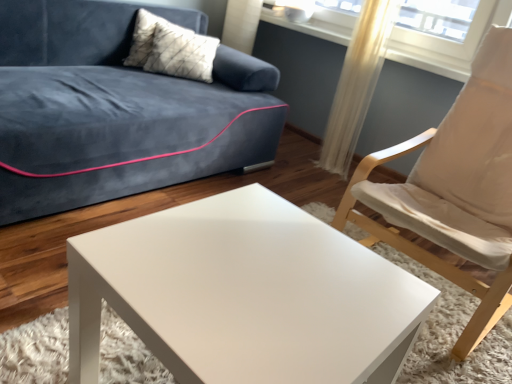
Question: Is white textured pillow at upper left behind translucent fabric curtain at upper right?

Choices:
 (A) yes
 (B) no

Answer: (A)

Question: From a real-world perspective, is white textured pillow at upper left physically above translucent fabric curtain at upper right?

Choices:
 (A) no
 (B) yes

Answer: (B)

Question: Does white textured pillow at upper left have a smaller size compared to translucent fabric curtain at upper right?

Choices:
 (A) yes
 (B) no

Answer: (B)

Question: Is translucent fabric curtain at upper right completely or partially inside white textured pillow at upper left?

Choices:
 (A) yes
 (B) no

Answer: (B)

Question: Is white textured pillow at upper left completely or partially outside of translucent fabric curtain at upper right?

Choices:
 (A) yes
 (B) no

Answer: (A)

Question: Is white textured pillow at upper left at the right side of translucent fabric curtain at upper right?

Choices:
 (A) no
 (B) yes

Answer: (A)

Question: Is white glossy coffee table at center in front of white fabric chair at right?

Choices:
 (A) no
 (B) yes

Answer: (B)

Question: From a real-world perspective, is white glossy coffee table at center positioned over white fabric chair at right based on gravity?

Choices:
 (A) yes
 (B) no

Answer: (B)

Question: Does white glossy coffee table at center turn towards white fabric chair at right?

Choices:
 (A) yes
 (B) no

Answer: (B)

Question: Can white fabric chair at right be found inside white glossy coffee table at center?

Choices:
 (A) yes
 (B) no

Answer: (B)

Question: Is white glossy coffee table at center at the right side of white fabric chair at right?

Choices:
 (A) no
 (B) yes

Answer: (A)

Question: From the image's perspective, is white glossy coffee table at center on white fabric chair at right?

Choices:
 (A) yes
 (B) no

Answer: (B)

Question: From a real-world perspective, is translucent fabric curtain at upper right under white textured pillow at upper left?

Choices:
 (A) yes
 (B) no

Answer: (A)